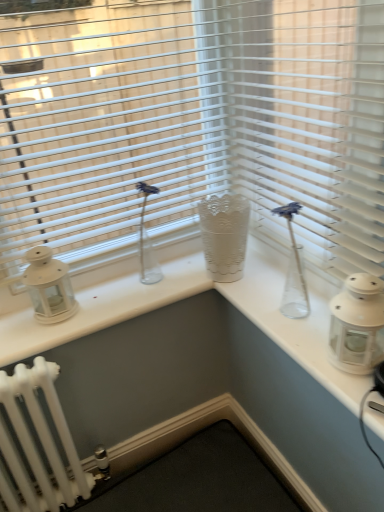
Question: In terms of size, does white plastic blinds at center appear bigger or smaller than white glass lantern at right, which appears as the first candle holder when viewed from the right?

Choices:
 (A) big
 (B) small

Answer: (A)

Question: From a real-world perspective, is white plastic blinds at center physically located above or below white glass lantern at right, the 2th candle holder viewed from the back?

Choices:
 (A) above
 (B) below

Answer: (A)

Question: Considering the real-world distances, which object is closest to the white plastic blinds at center?

Choices:
 (A) white glass lantern at right, the 2th candle holder in the left-to-right sequence
 (B) white plastic blinds at upper center
 (C) white matte lantern at left, which is the second candle holder in right-to-left order

Answer: (B)

Question: Which object is positioned farthest from the white glass lantern at right, the 2th candle holder in the left-to-right sequence?

Choices:
 (A) white matte lantern at left, which is the first candle holder in back-to-front order
 (B) white plastic blinds at upper center
 (C) white plastic blinds at center

Answer: (A)